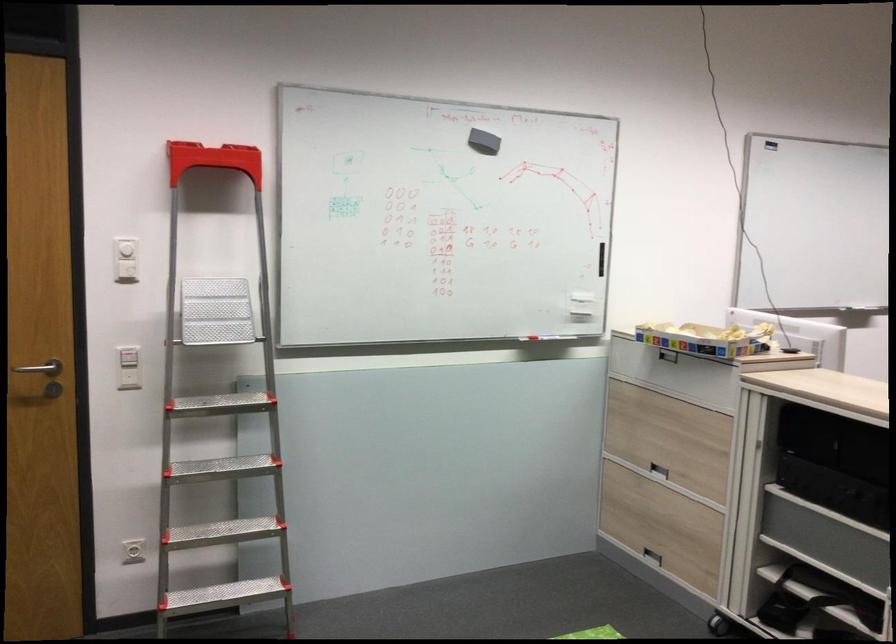
Where is `white wall dial`? Image resolution: width=896 pixels, height=644 pixels. white wall dial is located at coordinates (125, 249).